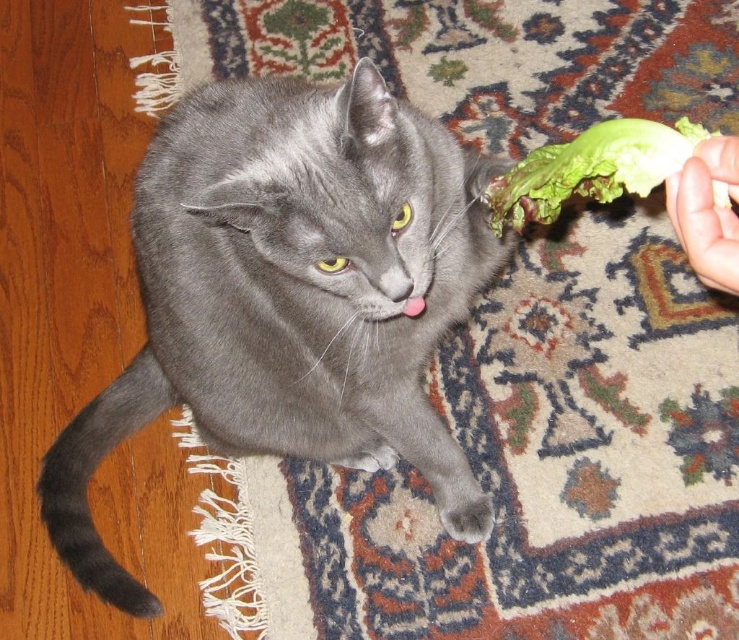
You are a cat trainer observing the scene. You see two points marked in the image. The first point is at coordinates point (541, 218) and the second point is at point (732, 152). Which point is closer to the gray cat with yellow eyes?

Point (732, 152) is closer to the gray cat with yellow eyes because it is in front of point (541, 218).

You are standing in front of the image and want to know how far the point at coordinates point (341,192) is from you. Can you determine the distance?

The point (341,192) is 82.80 centimeters away from the viewer.